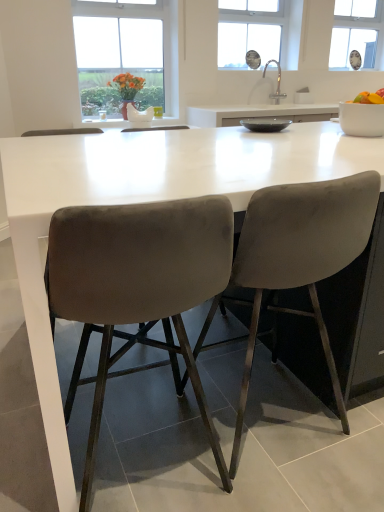
Question: Does point (359, 101) appear closer or farther from the camera than point (377, 195)?

Choices:
 (A) closer
 (B) farther

Answer: (B)

Question: Is yellow matte fruit bowl at right in front of or behind velvet grey chair at center, the 1th chair positioned from the right, in the image?

Choices:
 (A) behind
 (B) front

Answer: (A)

Question: Which object is positioned closest to the matte gray bowl at center, which appears as the 2th bowl when viewed from the right?

Choices:
 (A) clear glass sink at upper center
 (B) transparent plastic window screen at upper right
 (C) velvet grey chair at center, marked as the first chair in a left-to-right arrangement
 (D) velvet grey chair at center, the 1th chair positioned from the right
 (E) white ceramic sink at upper center

Answer: (D)

Question: Which is nearer to the matte gray bowl at center, which appears as the 2th bowl when viewed from the right?

Choices:
 (A) yellow matte fruit bowl at right
 (B) clear glass sink at upper center
 (C) white matte bowl at upper right, the 2th bowl viewed from the left
 (D) velvet grey chair at center, the 1th chair positioned from the right
 (E) white ceramic sink at upper center

Answer: (C)